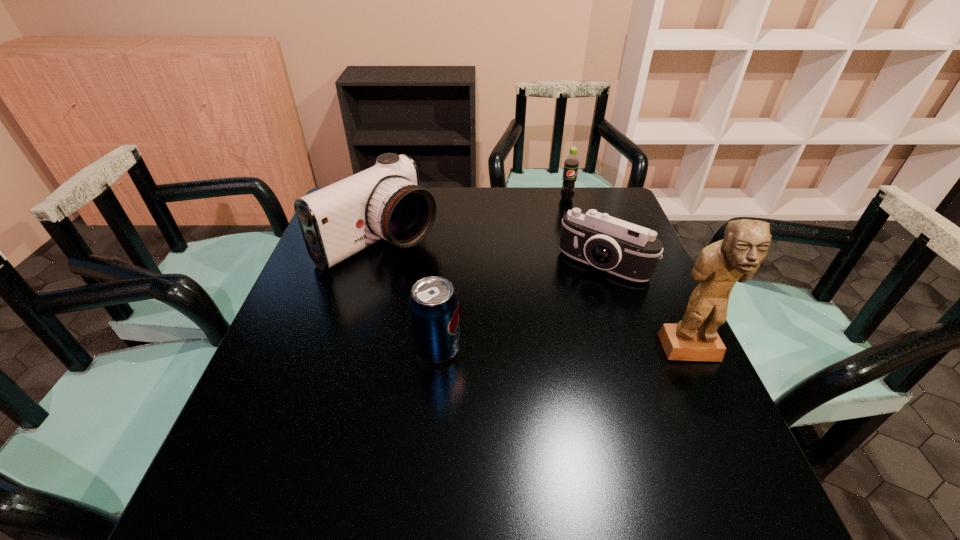
This screenshot has height=540, width=960. Identify the location of free spot on the desktop that is between the nearer soda and the tallest object and is positioned on the front label of the right soda. (585, 350).

Locate an element on the screen. This screenshot has width=960, height=540. vacant spot on the desktop that is between the nearer soda and the tallest object and is positioned on the front lens of the camera is located at coordinates (540, 350).

Identify the location of free space on the desktop that is between the nearer soda and the tallest object and is positioned on the surface of the fourth shortest object. Image resolution: width=960 pixels, height=540 pixels. (551, 350).